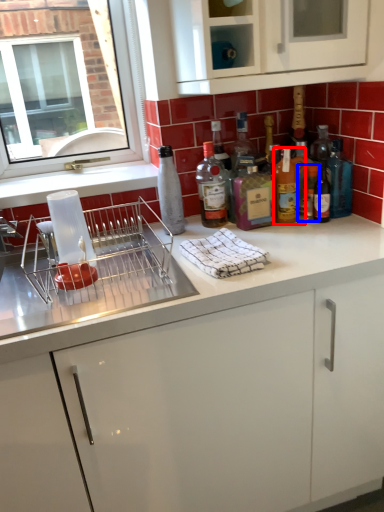
Question: Which object appears farthest to the camera in this image, bottle (highlighted by a red box) or bottle (highlighted by a blue box)?

Choices:
 (A) bottle
 (B) bottle

Answer: (B)